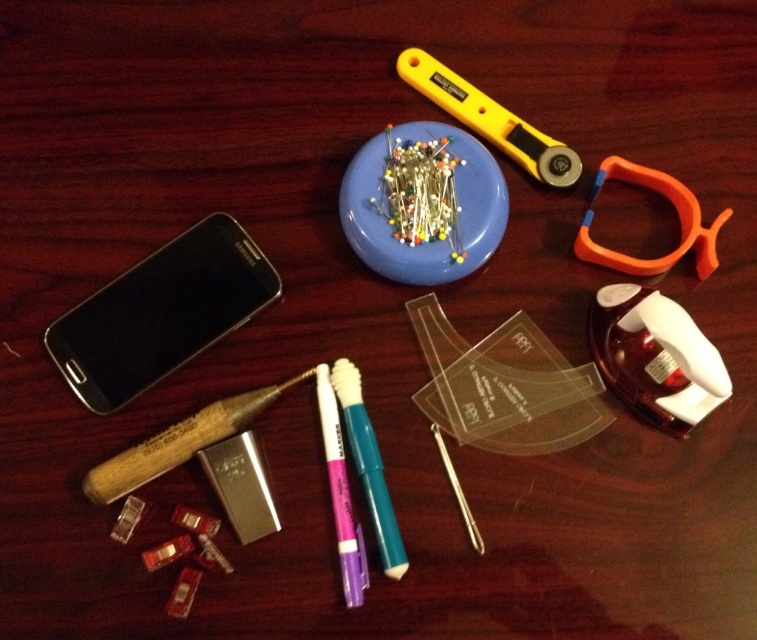
Question: Does yellow plastic scissors at upper center appear on the right side of wooden handle tool at lower left?

Choices:
 (A) yes
 (B) no

Answer: (A)

Question: Does yellow plastic scissors at upper center appear on the right side of purple matte pen at center?

Choices:
 (A) yes
 (B) no

Answer: (A)

Question: Which object appears farthest from the camera in this image?

Choices:
 (A) purple matte pen at center
 (B) black metallic smartphone at lower left
 (C) orange plastic scissors at upper right

Answer: (C)

Question: Which object is closer to the camera taking this photo?

Choices:
 (A) orange plastic scissors at upper right
 (B) yellow plastic scissors at upper center
 (C) black metallic smartphone at lower left

Answer: (C)

Question: Considering the real-world distances, which object is farthest from the purple matte pen at center?

Choices:
 (A) matte plastic markers at center
 (B) black metallic smartphone at lower left

Answer: (B)

Question: Observing the image, what is the correct spatial positioning of blue plastic plate at center in reference to yellow plastic scissors at upper center?

Choices:
 (A) right
 (B) left

Answer: (B)